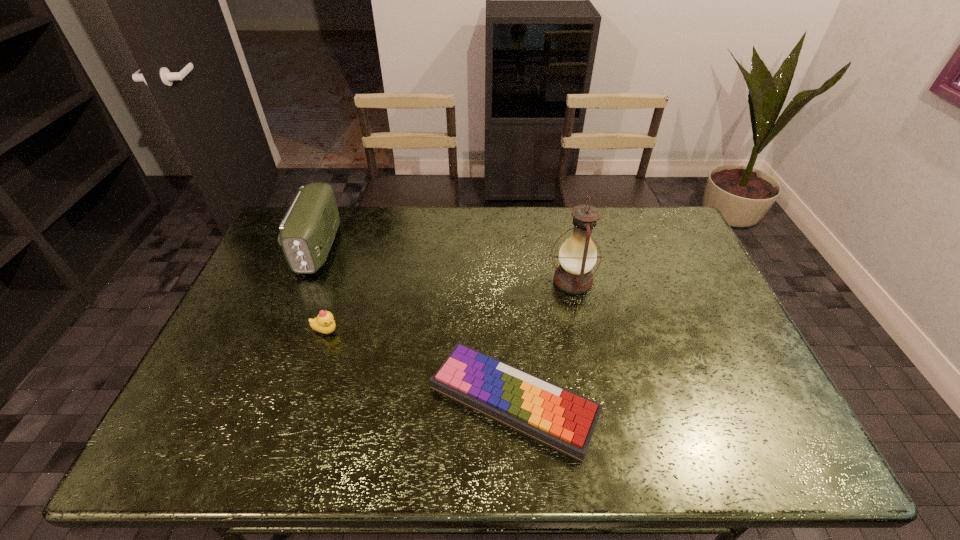
Where is `oil lamp`? This screenshot has width=960, height=540. oil lamp is located at coordinates (577, 256).

Identify the location of the third shortest object. The height and width of the screenshot is (540, 960). (307, 231).

Find the location of a particular element. This screenshot has height=540, width=960. the leftmost object is located at coordinates (307, 231).

This screenshot has width=960, height=540. In order to click on the second nearest object in this screenshot , I will do `click(324, 323)`.

Find the location of a particular element. The width and height of the screenshot is (960, 540). the second object from left to right is located at coordinates (324, 323).

In order to click on the shortest object in this screenshot , I will do `click(552, 415)`.

The height and width of the screenshot is (540, 960). I want to click on the nearest object, so (552, 415).

The width and height of the screenshot is (960, 540). Identify the location of vacant region located on the left of the tallest object. (468, 281).

Locate an element on the screen. Image resolution: width=960 pixels, height=540 pixels. free space located on the front-facing side of the radio_receiver is located at coordinates (275, 357).

Identify the location of free space located on the front-facing side of the third farthest object. Image resolution: width=960 pixels, height=540 pixels. (480, 331).